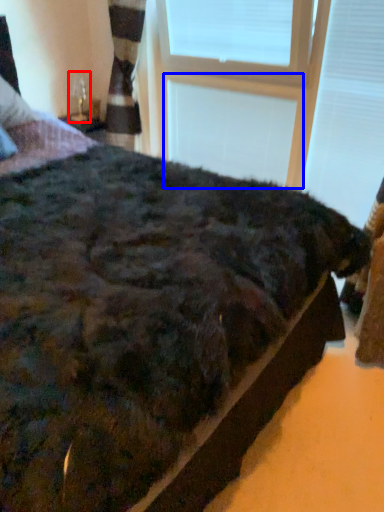
Question: Which object is closer to the camera taking this photo, table lamp (highlighted by a red box) or window frame (highlighted by a blue box)?

Choices:
 (A) table lamp
 (B) window frame

Answer: (B)